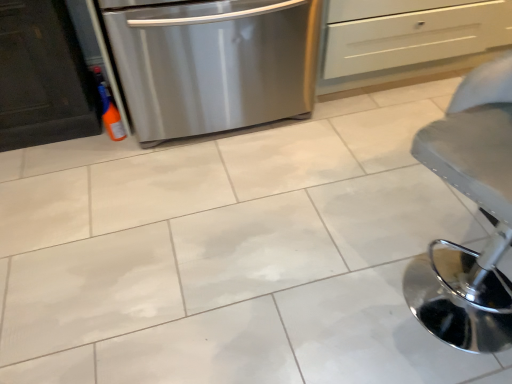
What are the coordinates of `vacant region to the left of metallic gray stool at lower right` in the screenshot? It's located at (343, 285).